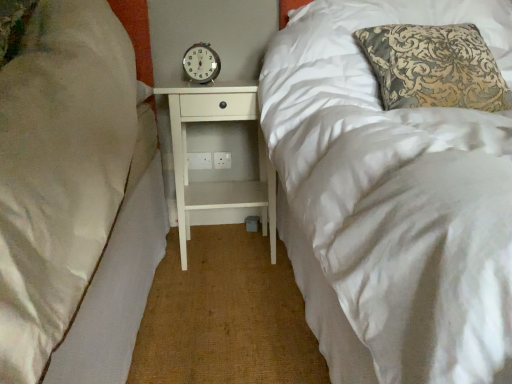
This screenshot has height=384, width=512. In order to click on white wood nightstand at center in this screenshot , I will do `click(218, 181)`.

What do you see at coordinates (218, 181) in the screenshot? I see `white wood nightstand at center` at bounding box center [218, 181].

What do you see at coordinates (201, 63) in the screenshot?
I see `metallic analog clock at center` at bounding box center [201, 63].

Locate an element on the screen. metallic analog clock at center is located at coordinates (201, 63).

Locate an element on the screen. The height and width of the screenshot is (384, 512). white wood nightstand at center is located at coordinates (218, 181).

In the image, is white wood nightstand at center on the left side or the right side of metallic analog clock at center?

Clearly, white wood nightstand at center is on the right of metallic analog clock at center in the image.

Is white wood nightstand at center in front of metallic analog clock at center?

Yes, the depth of white wood nightstand at center is less than that of metallic analog clock at center.

Which is farther from the camera, (178,194) or (215,71)?

Point (178,194)

From the image's perspective, is white wood nightstand at center over metallic analog clock at center?

No, from the image's perspective, white wood nightstand at center is not above metallic analog clock at center.

From a real-world perspective, who is located higher, white wood nightstand at center or metallic analog clock at center?

metallic analog clock at center.

Considering the sizes of white wood nightstand at center and metallic analog clock at center in the image, is white wood nightstand at center wider or thinner than metallic analog clock at center?

In the image, white wood nightstand at center appears to be wider than metallic analog clock at center.

Who is taller, white wood nightstand at center or metallic analog clock at center?

white wood nightstand at center.

Is white wood nightstand at center bigger or smaller than metallic analog clock at center?

Clearly, white wood nightstand at center is larger in size than metallic analog clock at center.

Is metallic analog clock at center located within white wood nightstand at center?

No, metallic analog clock at center is not a part of white wood nightstand at center.

Is the surface of white wood nightstand at center in direct contact with metallic analog clock at center?

white wood nightstand at center and metallic analog clock at center are not in contact.

Is white wood nightstand at center facing towards metallic analog clock at center?

No.

Locate an element on the screen. The image size is (512, 384). clock on the left of white wood nightstand at center is located at coordinates (201, 63).

Considering the positions of objects metallic analog clock at center and white wood nightstand at center in the image provided, who is more to the left, metallic analog clock at center or white wood nightstand at center?

From the viewer's perspective, metallic analog clock at center appears more on the left side.

Is metallic analog clock at center closer to camera compared to white wood nightstand at center?

No, it is not.

Between point (202, 56) and point (262, 178), which one is positioned behind?

The point (262, 178) is farther.

From the image's perspective, is metallic analog clock at center above or below white wood nightstand at center?

From the image's perspective, metallic analog clock at center appears above white wood nightstand at center.

From a real-world perspective, who is located lower, metallic analog clock at center or white wood nightstand at center?

white wood nightstand at center.

Is metallic analog clock at center wider or thinner than white wood nightstand at center?

metallic analog clock at center is thinner than white wood nightstand at center.

In the scene shown: Can you confirm if metallic analog clock at center is taller than white wood nightstand at center?

In fact, metallic analog clock at center may be shorter than white wood nightstand at center.

Which of these two, metallic analog clock at center or white wood nightstand at center, is bigger?

Bigger between the two is white wood nightstand at center.

Is white wood nightstand at center inside metallic analog clock at center?

No.

Can you see metallic analog clock at center touching white wood nightstand at center?

No, metallic analog clock at center is not making contact with white wood nightstand at center.

Consider the image. Is metallic analog clock at center positioned with its back to white wood nightstand at center?

No, metallic analog clock at center is not facing away from white wood nightstand at center.

How much distance is there between metallic analog clock at center and white wood nightstand at center?

The distance of metallic analog clock at center from white wood nightstand at center is 11.35 inches.

Image resolution: width=512 pixels, height=384 pixels. In order to click on clock above the white wood nightstand at center (from a real-world perspective) in this screenshot , I will do `click(201, 63)`.

Where is `clock lying above the white wood nightstand at center (from the image's perspective)`? clock lying above the white wood nightstand at center (from the image's perspective) is located at coordinates (201, 63).

This screenshot has width=512, height=384. I want to click on clock above the white wood nightstand at center (from a real-world perspective), so click(x=201, y=63).